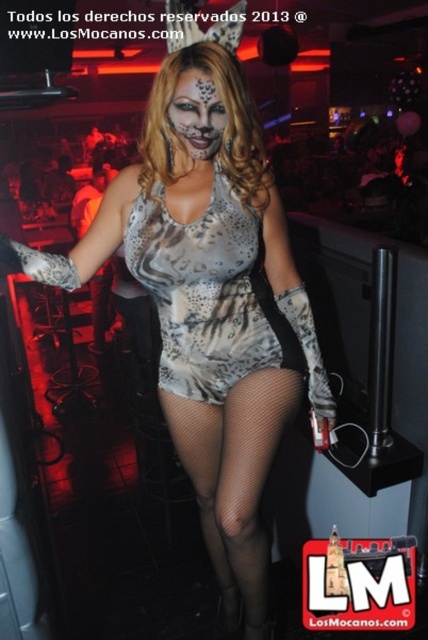
Question: Which point appears farthest from the camera in this image?

Choices:
 (A) (265, 321)
 (B) (232, 404)
 (C) (178, 365)
 (D) (187, 106)

Answer: (C)

Question: Which point appears farthest from the camera in this image?

Choices:
 (A) (168, 106)
 (B) (281, 380)

Answer: (B)

Question: From the image, what is the correct spatial relationship of silver metallic dress at center in relation to matte silver paint at center?

Choices:
 (A) right
 (B) left

Answer: (B)

Question: Is fishnet stockings at lower center above matte silver paint at center?

Choices:
 (A) no
 (B) yes

Answer: (A)

Question: From the image, what is the correct spatial relationship of silver metallic dress at center in relation to fishnet stockings at lower center?

Choices:
 (A) right
 (B) left

Answer: (B)

Question: Which point is farther from the camera taking this photo?

Choices:
 (A) (267, 598)
 (B) (309, 356)

Answer: (A)